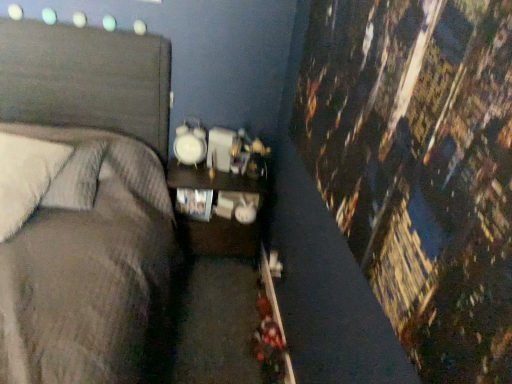
Question: From the image's perspective, is white soft pillow at left, which ranks as the 1th pillow in back-to-front order, above matte wood nightstand at center?

Choices:
 (A) yes
 (B) no

Answer: (A)

Question: Can you confirm if white soft pillow at left, which ranks as the 1th pillow in back-to-front order, is taller than matte wood nightstand at center?

Choices:
 (A) no
 (B) yes

Answer: (A)

Question: From a real-world perspective, is white soft pillow at left, which ranks as the 1th pillow in back-to-front order, beneath matte wood nightstand at center?

Choices:
 (A) yes
 (B) no

Answer: (B)

Question: Considering the relative positions of white soft pillow at left, the 2th pillow from the front, and matte wood nightstand at center in the image provided, is white soft pillow at left, the 2th pillow from the front, to the left of matte wood nightstand at center from the viewer's perspective?

Choices:
 (A) yes
 (B) no

Answer: (A)

Question: Considering the positions of point (4, 201) and point (87, 190), is point (4, 201) closer or farther from the camera than point (87, 190)?

Choices:
 (A) farther
 (B) closer

Answer: (B)

Question: In the image, is white soft pillow at left, the second pillow positioned from the back, positioned in front of or behind white soft pillow at left, the 2th pillow from the front?

Choices:
 (A) front
 (B) behind

Answer: (A)

Question: From the image's perspective, is white soft pillow at left, the second pillow positioned from the back, positioned above or below white soft pillow at left, which ranks as the 1th pillow in back-to-front order?

Choices:
 (A) above
 (B) below

Answer: (B)

Question: Which is correct: white soft pillow at left, the second pillow positioned from the back, is inside white soft pillow at left, which ranks as the 1th pillow in back-to-front order, or outside of it?

Choices:
 (A) outside
 (B) inside

Answer: (B)

Question: Considering the positions of matte wood nightstand at center and white soft pillow at left, which ranks as the 1th pillow in back-to-front order, in the image, is matte wood nightstand at center taller or shorter than white soft pillow at left, which ranks as the 1th pillow in back-to-front order,?

Choices:
 (A) short
 (B) tall

Answer: (B)

Question: From a real-world perspective, is matte wood nightstand at center above or below white soft pillow at left, the 2th pillow from the front?

Choices:
 (A) above
 (B) below

Answer: (B)

Question: From the image's perspective, is matte wood nightstand at center positioned above or below white soft pillow at left, which ranks as the 1th pillow in back-to-front order?

Choices:
 (A) below
 (B) above

Answer: (A)

Question: Is point (223, 233) positioned closer to the camera than point (96, 162)?

Choices:
 (A) farther
 (B) closer

Answer: (A)

Question: Is white soft pillow at left, the second pillow positioned from the back, bigger or smaller than matte wood nightstand at center?

Choices:
 (A) small
 (B) big

Answer: (A)

Question: In terms of height, does white soft pillow at left, the second pillow positioned from the back, look taller or shorter compared to matte wood nightstand at center?

Choices:
 (A) tall
 (B) short

Answer: (B)